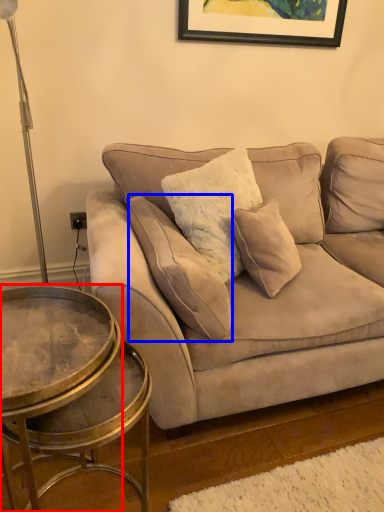
Question: Which point is further to the camera, coffee table (highlighted by a red box) or pillow (highlighted by a blue box)?

Choices:
 (A) coffee table
 (B) pillow

Answer: (B)